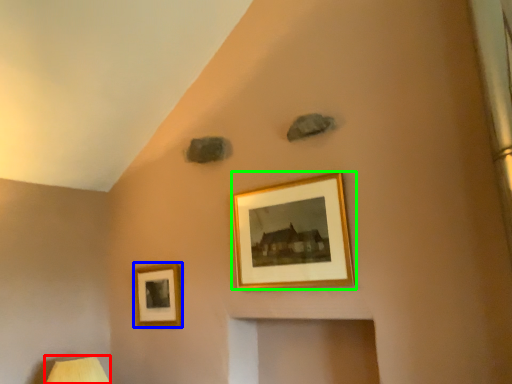
Question: Considering the real-world distances, which object is closest to table lamp (highlighted by a red box)? picture frame (highlighted by a blue box) or picture frame (highlighted by a green box).

Choices:
 (A) picture frame
 (B) picture frame

Answer: (A)